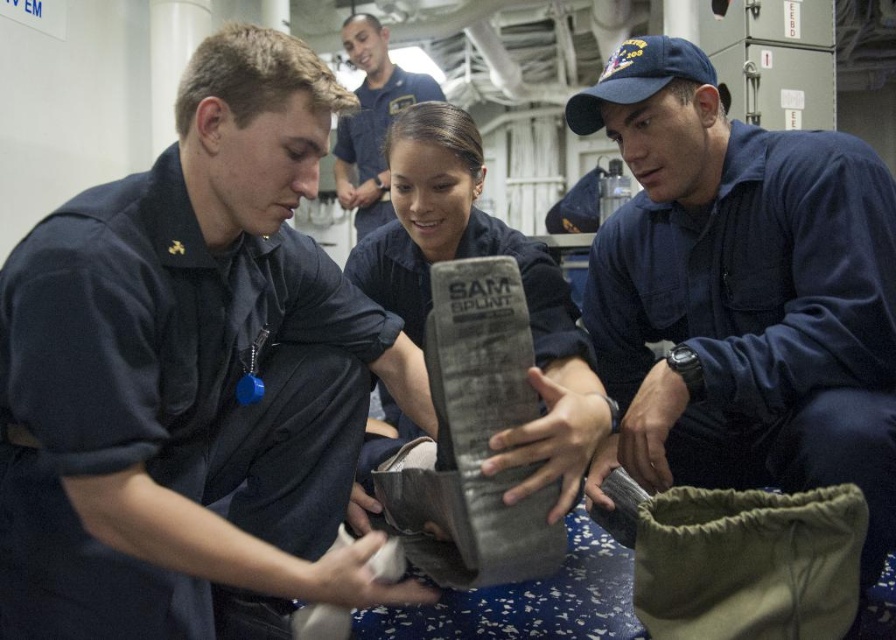
You are a medical trainee on a ship and need to locate the SAM SPLINT during an emergency. Based on the scene, where would you find the matte gray splint at center relative to the blue uniform shirt at upper center?

The matte gray splint at center is located below the blue uniform shirt at upper center.

You are a medical trainer preparing a demonstration. You need to place the matte gray splint at center on a shelf next to the blue uniform shirt at upper center. The shelf has limited space. Based on their widths, can the splint and the shirt be placed side by side without overlapping?

The matte gray splint at center has a lesser width compared to blue uniform shirt at upper center. Since the splint is narrower, it may fit alongside the shirt, but the total combined width of both items might exceed the shelf space. Check the shelf dimensions to confirm.

You are a new recruit observing the scene. There are two people in uniforms near the SAM SPLINT. One is wearing a matte black uniform at center and another in a blue uniform shirt at upper center. Which uniform is positioned lower in the image?

The matte black uniform at center is below the blue uniform shirt at upper center, so the matte black uniform at center is positioned lower in the image.